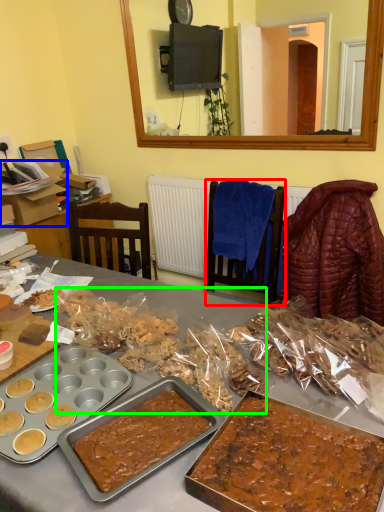
Question: Considering the real-world distances, which object is closest to chair (highlighted by a red box)? box (highlighted by a blue box) or snack (highlighted by a green box).

Choices:
 (A) box
 (B) snack

Answer: (B)